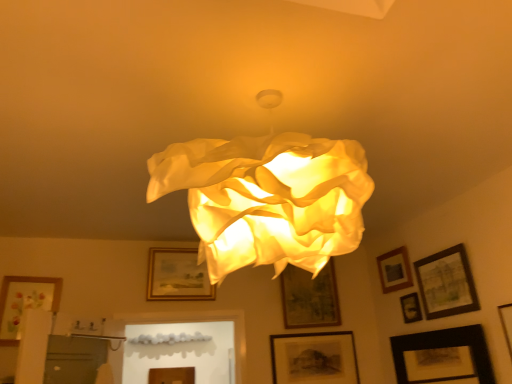
Question: From the image's perspective, would you say matte floral print picture frame at lower left, which is the tenth picture frame in right-to-left order, is shown under wooden framed picture at center, marked as the third picture frame in a left-to-right arrangement?

Choices:
 (A) no
 (B) yes

Answer: (B)

Question: From a real-world perspective, is matte floral print picture frame at lower left, which is the tenth picture frame in right-to-left order, physically above wooden framed picture at center, marked as the third picture frame in a left-to-right arrangement?

Choices:
 (A) yes
 (B) no

Answer: (B)

Question: Is matte floral print picture frame at lower left, the 1th picture frame viewed from the left, bigger than wooden framed picture at center, marked as the third picture frame in a left-to-right arrangement?

Choices:
 (A) yes
 (B) no

Answer: (B)

Question: Can you confirm if matte floral print picture frame at lower left, which is the tenth picture frame in right-to-left order, is thinner than wooden framed picture at center, marked as the third picture frame in a left-to-right arrangement?

Choices:
 (A) no
 (B) yes

Answer: (B)

Question: Considering the relative positions of matte floral print picture frame at lower left, which is the tenth picture frame in right-to-left order, and wooden framed picture at center, placed as the eighth picture frame when sorted from right to left, in the image provided, is matte floral print picture frame at lower left, which is the tenth picture frame in right-to-left order, in front of wooden framed picture at center, placed as the eighth picture frame when sorted from right to left,?

Choices:
 (A) yes
 (B) no

Answer: (A)

Question: Is wooden framed picture at center, placed as the eighth picture frame when sorted from right to left, a part of matte floral print picture frame at lower left, the 1th picture frame viewed from the left?

Choices:
 (A) no
 (B) yes

Answer: (A)

Question: From the image's perspective, is matte floral print picture frame at lower left, the 1th picture frame viewed from the left, over wooden framed picture at upper right, placed as the second picture frame when sorted from right to left?

Choices:
 (A) yes
 (B) no

Answer: (B)

Question: From a real-world perspective, is matte floral print picture frame at lower left, the 1th picture frame viewed from the left, positioned under wooden framed picture at upper right, which is the ninth picture frame in left-to-right order, based on gravity?

Choices:
 (A) no
 (B) yes

Answer: (B)

Question: Does matte floral print picture frame at lower left, which is the tenth picture frame in right-to-left order, come in front of wooden framed picture at upper right, which is the ninth picture frame in left-to-right order?

Choices:
 (A) yes
 (B) no

Answer: (B)

Question: From a real-world perspective, is matte floral print picture frame at lower left, the 1th picture frame viewed from the left, over wooden framed picture at upper right, which is the ninth picture frame in left-to-right order?

Choices:
 (A) no
 (B) yes

Answer: (A)

Question: Can you confirm if matte floral print picture frame at lower left, the 1th picture frame viewed from the left, is positioned to the right of wooden framed picture at upper right, placed as the second picture frame when sorted from right to left?

Choices:
 (A) yes
 (B) no

Answer: (B)

Question: Is matte floral print picture frame at lower left, which is the tenth picture frame in right-to-left order, further to camera compared to wooden framed picture at upper right, which is the ninth picture frame in left-to-right order?

Choices:
 (A) no
 (B) yes

Answer: (B)

Question: Is the position of matte black picture frame at lower right, the 4th picture frame viewed from the right, more distant than that of black matte picture frame at lower right, the third picture frame in the right-to-left sequence?

Choices:
 (A) yes
 (B) no

Answer: (A)